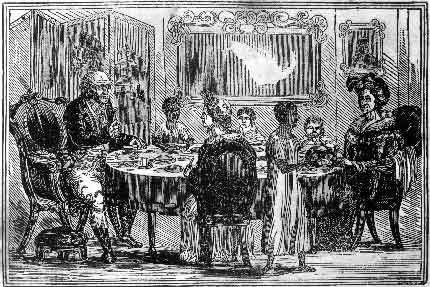
Where is `victorian era chairs`? victorian era chairs is located at coordinates (393, 202), (37, 169).